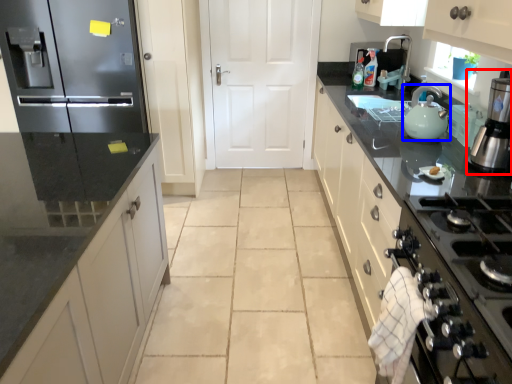
Question: Among these objects, which one is nearest to the camera, home appliance (highlighted by a red box) or kitchen appliance (highlighted by a blue box)?

Choices:
 (A) home appliance
 (B) kitchen appliance

Answer: (A)